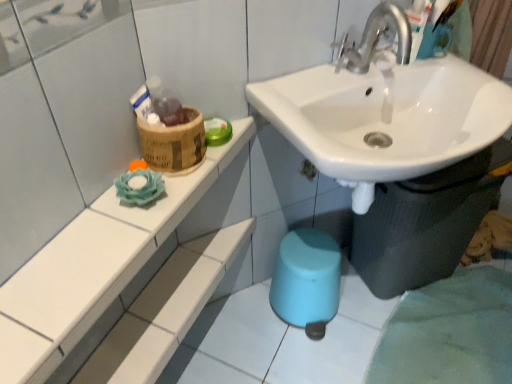
The image size is (512, 384). What are the coordinates of `vacant space in front of bamboo basket at upper left` in the screenshot? It's located at (141, 211).